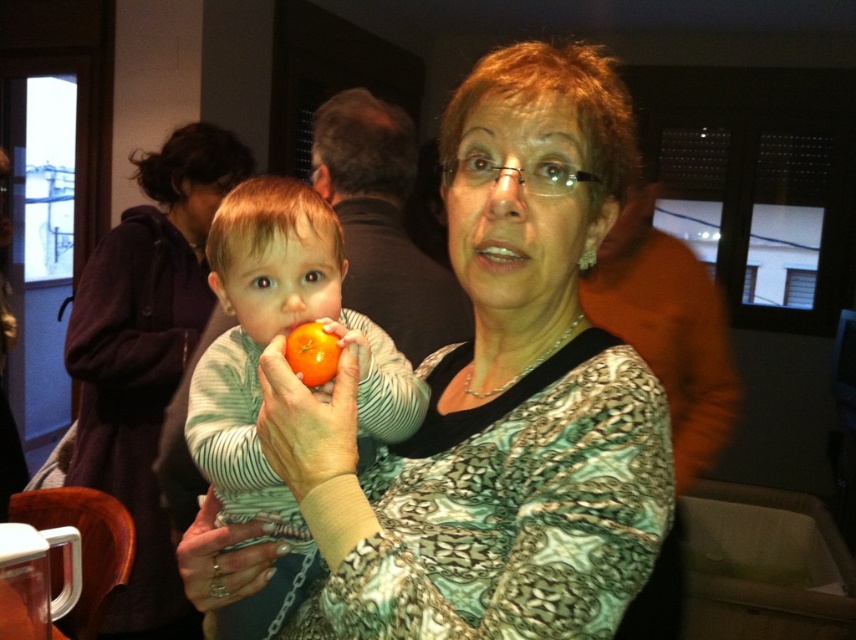
Looking at this image, you are organizing a clothing display and need to arrange the matte green dress at center and the matte black sweater at center based on their heights. Which one should be placed lower on the rack to ensure proper visibility of both items?

The matte green dress at center is not as tall as the matte black sweater at center, so it should be placed lower on the rack to ensure proper visibility of both items.

You are a photographer taking a photo of the matte green dress at center and the smooth orange at center. Which object should you zoom in on to ensure both are in focus without moving the camera?

The matte green dress at center has a larger size compared to smooth orange at center, so you should zoom in on the smaller object, the smooth orange at center, to ensure both are in focus without moving the camera.

You are an interior designer planning to place a new decorative item in the scene. The metallic ring at center is located at point [224,557]. Where should you place the new item to avoid overlapping with the metallic ring at center?

Place the new decorative item away from the coordinates [224,557] to avoid overlapping with the metallic ring at center.